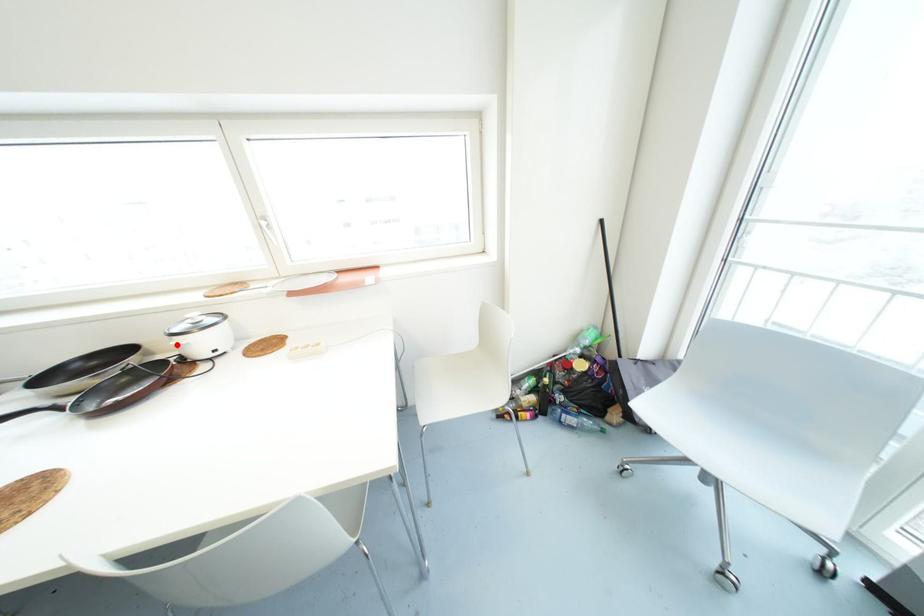
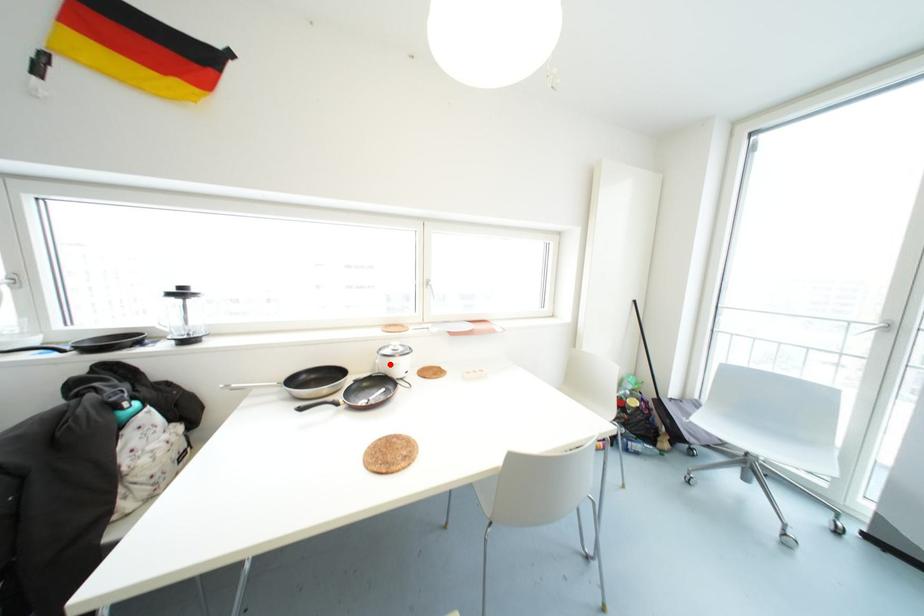
I am providing you with two images of the same scene from different viewpoints. A red point is marked on the first image and another point is marked on the second image. Are the points marked in image1 and image2 representing the same 3D position?

Yes